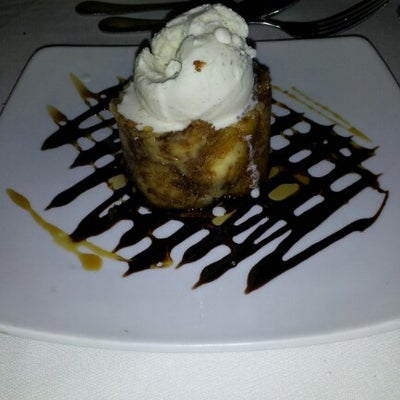
Find the location of a particular element. This screenshot has width=400, height=400. fork is located at coordinates (298, 26).